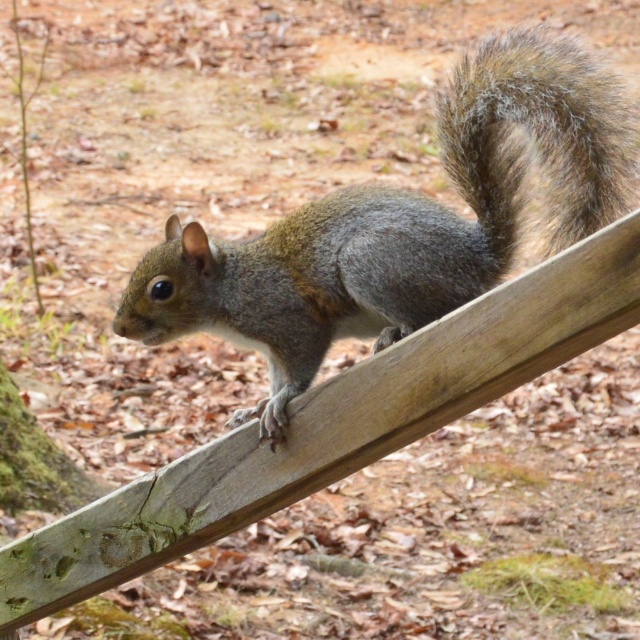
You are a bird flying over the forest and you see the gray furry squirrel on the right and the fuzzy brown tail at upper right. Which one is taller?

The gray furry squirrel on the right is much taller than the fuzzy brown tail at upper right.